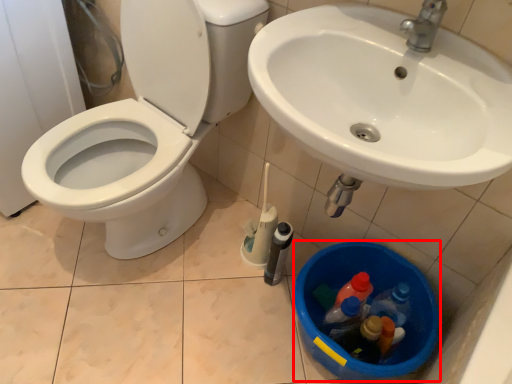
Question: From the image's perspective, where is potty (annotated by the red box) located relative to toilet?

Choices:
 (A) above
 (B) below

Answer: (B)